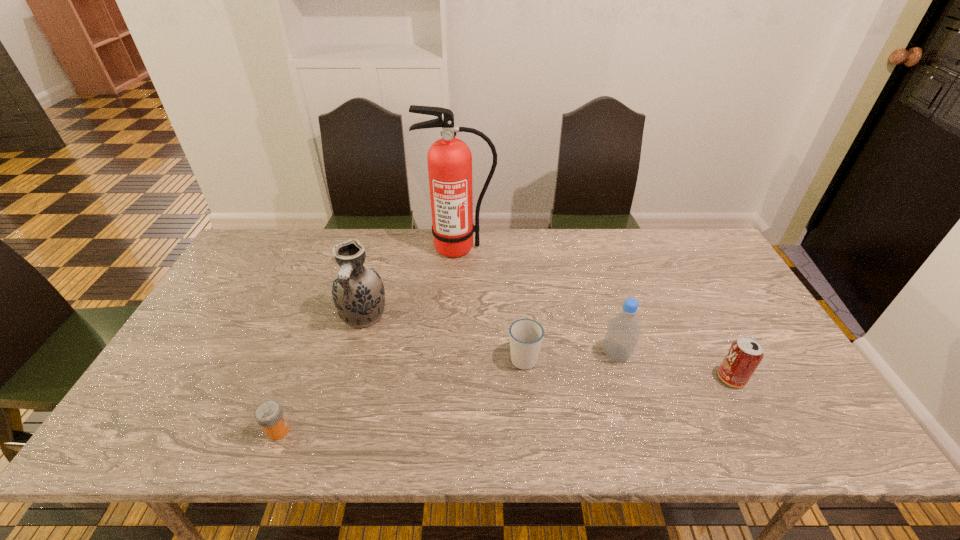
Where is `vacant region between the shortest object and the second tallest object`? This screenshot has width=960, height=540. vacant region between the shortest object and the second tallest object is located at coordinates (321, 373).

The height and width of the screenshot is (540, 960). Identify the location of free spot between the fifth shortest object and the rightmost object. (547, 347).

At what (x,y) coordinates should I click in order to perform the action: click on vacant space that's between the nearest object and the rightmost object. Please return your answer as a coordinate pair (x, y). This screenshot has width=960, height=540. Looking at the image, I should click on (505, 404).

Identify the location of vacant region between the third tallest object and the fourth object from left to right. (570, 356).

You are a GUI agent. You are given a task and a screenshot of the screen. Output one action in this format:
    pyautogui.click(x=<x>, y=<y>)
    Task: Click on the free space between the leftmost object and the rightmost object
    The width and height of the screenshot is (960, 540).
    Given the screenshot: What is the action you would take?
    pyautogui.click(x=505, y=404)

This screenshot has width=960, height=540. I want to click on free space between the rightmost object and the fourth object from left to right, so click(x=628, y=368).

Identify the location of object that is the third closest to the cup. This screenshot has height=540, width=960. (449, 159).

Where is `the fifth closest object relative to the soda can`? Image resolution: width=960 pixels, height=540 pixels. the fifth closest object relative to the soda can is located at coordinates (x=269, y=414).

Where is `blank space that satisfies the following two spatial constraints: 1. with a handle on the side of the cup; 2. on the right side of the third tallest object`? This screenshot has height=540, width=960. blank space that satisfies the following two spatial constraints: 1. with a handle on the side of the cup; 2. on the right side of the third tallest object is located at coordinates (523, 354).

What are the coordinates of `free space that satisfies the following two spatial constraints: 1. with the handle on the side of the rightmost object; 2. on the right side of the second object from left to right` in the screenshot? It's located at (347, 378).